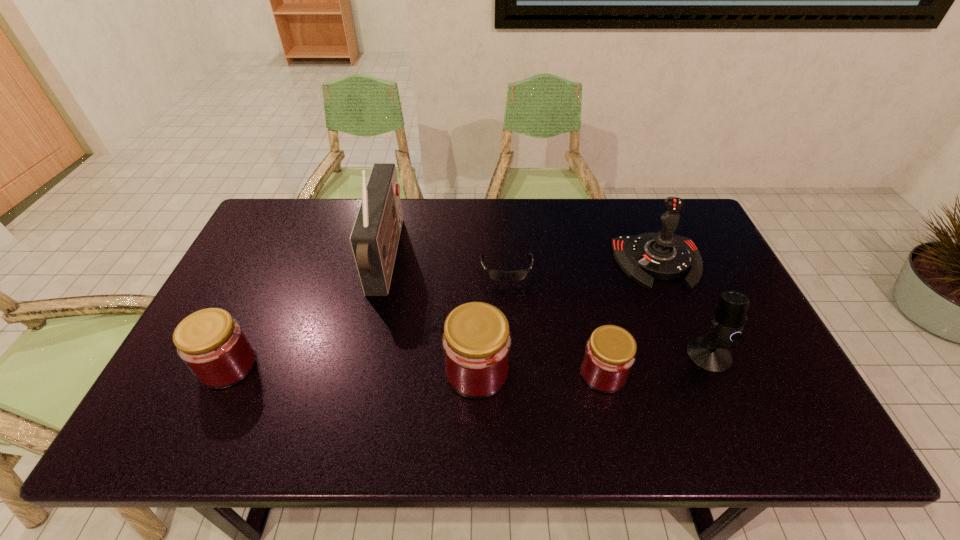
Where is `free area in between the leftmost object and the radio receiver`? This screenshot has height=540, width=960. free area in between the leftmost object and the radio receiver is located at coordinates (307, 312).

You are a GUI agent. You are given a task and a screenshot of the screen. Output one action in this format:
    pyautogui.click(x=<x>, y=<y>)
    Task: Click on the free space between the microphone and the shortest jam
    Image resolution: width=960 pixels, height=540 pixels.
    Given the screenshot: What is the action you would take?
    pyautogui.click(x=656, y=364)

Identify the location of free space between the joystick and the second jam from left to right. (567, 317).

At what (x,y) coordinates should I click in order to perform the action: click on free space between the joystick and the microphone. Please return your answer as a coordinate pair (x, y). The width and height of the screenshot is (960, 540). Looking at the image, I should click on (684, 309).

Find the location of `free spot between the fifth tallest object and the sixth object from right to left`. free spot between the fifth tallest object and the sixth object from right to left is located at coordinates (307, 312).

Where is `free spot between the microphone and the tallest object`? free spot between the microphone and the tallest object is located at coordinates (547, 307).

Image resolution: width=960 pixels, height=540 pixels. What are the coordinates of `free space between the fifth object from left to right and the second jam from right to left` in the screenshot? It's located at [x=540, y=372].

Locate an element on the screen. The image size is (960, 540). free spot between the leftmost object and the shortest object is located at coordinates (368, 318).

Where is `object that is the second closest to the shortest jam`? object that is the second closest to the shortest jam is located at coordinates (476, 342).

The image size is (960, 540). I want to click on object that stands as the sixth closest to the radio receiver, so click(x=710, y=353).